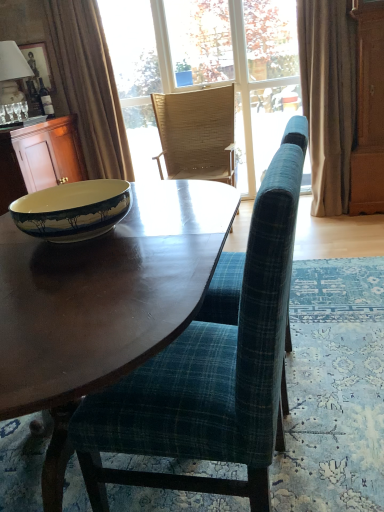
Where is `free location in front of matte ceramic bowl at left`? The height and width of the screenshot is (512, 384). free location in front of matte ceramic bowl at left is located at coordinates pyautogui.click(x=79, y=274).